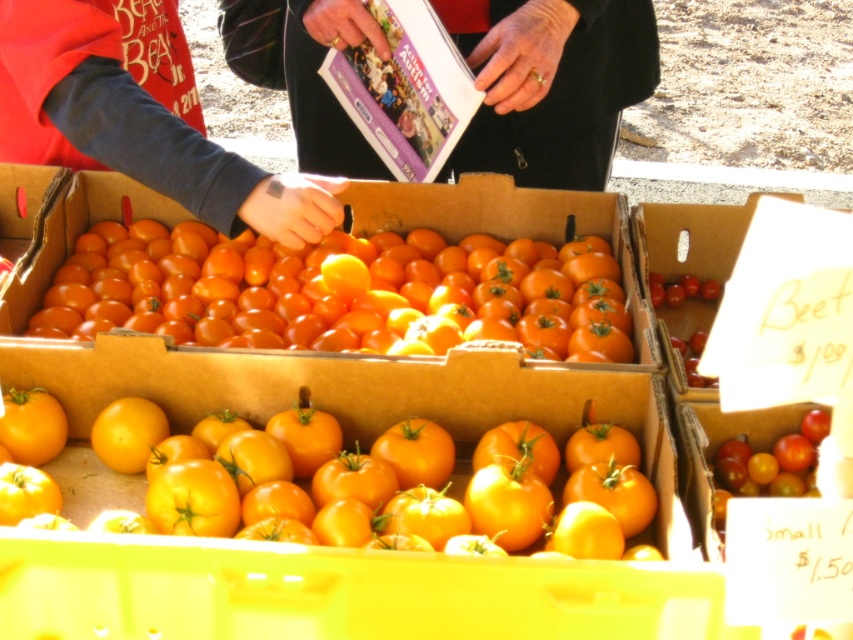
You are a customer at the farmer market looking for a shiny orange tomato at center. You see a smooth cardboard box at upper center. Which object is positioned to the right side?

The smooth cardboard box at upper center is positioned to the right of the shiny orange tomato at center.

You are a customer at the farmer market and want to buy the taller tomato between the yellow matte tomato at center and the shiny orange tomato at center. Which one should you choose?

The shiny orange tomato at center is taller than the yellow matte tomato at center, so you should choose the shiny orange tomato at center.

You are a customer at the farmer market and want to place a yellow matte tomato at center and a shiny orange tomato at center into a basket that is 12 inches wide. Will both tomatoes fit side by side in the basket?

The yellow matte tomato at center is 10.12 inches from the shiny orange tomato at center, so yes, both tomatoes can fit side by side in the basket since the distance between them is less than the basket width of 12 inches.